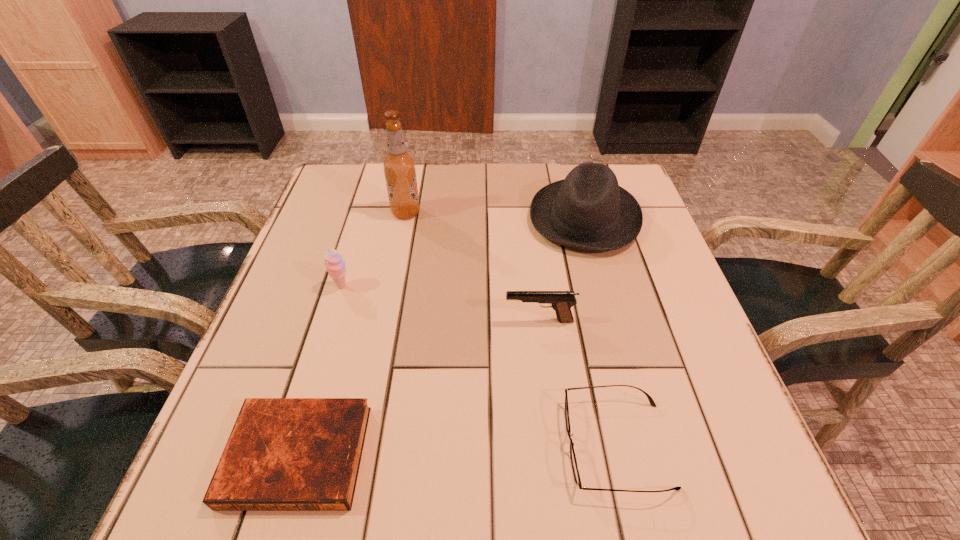
At what (x,y) coordinates should I click in order to perform the action: click on free spot between the fedora and the third farthest object. Please return your answer as a coordinate pair (x, y). Looking at the image, I should click on (463, 252).

This screenshot has width=960, height=540. What are the coordinates of `free spot between the spectacles and the fourth tallest object` in the screenshot? It's located at (578, 383).

Point out which object is positioned as the second nearest to the sherbert. Please provide its 2D coordinates. Your answer should be formatted as a tuple, i.e. [(x, y)], where the tuple contains the x and y coordinates of a point satisfying the conditions above.

[(283, 454)]

Point out which object is positioned as the fifth nearest to the beer bottle. Please provide its 2D coordinates. Your answer should be formatted as a tuple, i.e. [(x, y)], where the tuple contains the x and y coordinates of a point satisfying the conditions above.

[(576, 474)]

Where is `vacant region that satisfies the following two spatial constraints: 1. at the muzzle of the third shortest object; 2. on the spine side of the Bible`? This screenshot has height=540, width=960. vacant region that satisfies the following two spatial constraints: 1. at the muzzle of the third shortest object; 2. on the spine side of the Bible is located at coordinates (555, 455).